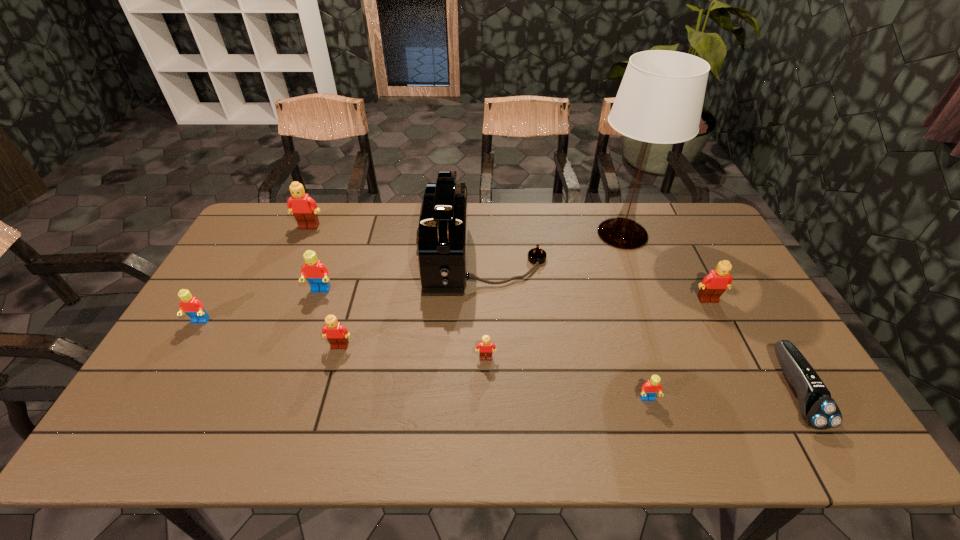
Locate an element on the screen. The width and height of the screenshot is (960, 540). unoccupied area between the third Lego from right to left and the second biggest brown Lego is located at coordinates (597, 329).

Where is `object that is the eighth closest to the sixth farthest Lego`? object that is the eighth closest to the sixth farthest Lego is located at coordinates (190, 305).

Identify which object is located as the eighth nearest to the nearest Lego. Please provide its 2D coordinates. Your answer should be formatted as a tuple, i.e. [(x, y)], where the tuple contains the x and y coordinates of a point satisfying the conditions above.

[(304, 208)]

Select which Lego appears as the seventh closest to the rightmost object. Please provide its 2D coordinates. Your answer should be formatted as a tuple, i.e. [(x, y)], where the tuple contains the x and y coordinates of a point satisfying the conditions above.

[(190, 305)]

Select which Lego appears as the third closest to the nearest Lego. Please provide its 2D coordinates. Your answer should be formatted as a tuple, i.e. [(x, y)], where the tuple contains the x and y coordinates of a point satisfying the conditions above.

[(336, 334)]

You are a GUI agent. You are given a task and a screenshot of the screen. Output one action in this format:
    pyautogui.click(x=<x>, y=<y>)
    Task: Click on the brown Lego that is the closest one to the nearest brown Lego
    
    Given the screenshot: What is the action you would take?
    pyautogui.click(x=336, y=334)

You are a GUI agent. You are given a task and a screenshot of the screen. Output one action in this format:
    pyautogui.click(x=<x>, y=<y>)
    Task: Click on the brown Lego that stands as the fourth closest to the third object from left to right
    Image resolution: width=960 pixels, height=540 pixels.
    Given the screenshot: What is the action you would take?
    pyautogui.click(x=713, y=285)

Where is `red Lego that is the third closest to the fourth Lego from right to left`? Image resolution: width=960 pixels, height=540 pixels. red Lego that is the third closest to the fourth Lego from right to left is located at coordinates (652, 387).

Identify which red Lego is located as the second nearest to the smallest brown Lego. Please provide its 2D coordinates. Your answer should be formatted as a tuple, i.e. [(x, y)], where the tuple contains the x and y coordinates of a point satisfying the conditions above.

[(316, 273)]